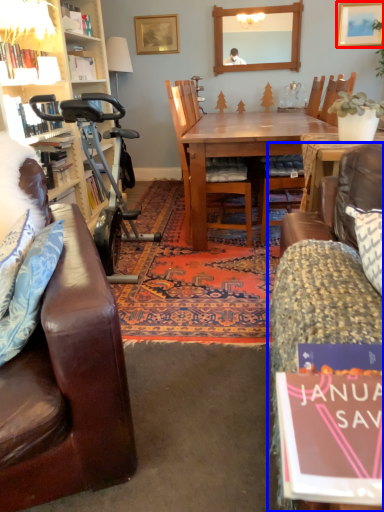
Question: Which point is further to the camera, picture frame (highlighted by a red box) or studio couch (highlighted by a blue box)?

Choices:
 (A) picture frame
 (B) studio couch

Answer: (A)